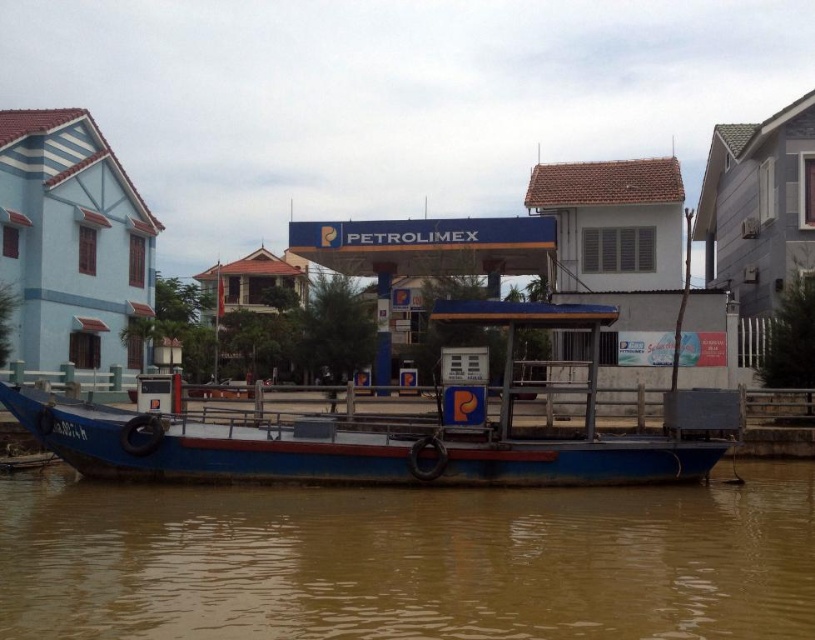
Question: Does brown muddy water at lower center appear on the right side of blue matte boat at center?

Choices:
 (A) no
 (B) yes

Answer: (B)

Question: Is the position of brown muddy water at lower center less distant than that of blue matte boat at center?

Choices:
 (A) no
 (B) yes

Answer: (B)

Question: Does brown muddy water at lower center lie behind blue matte boat at center?

Choices:
 (A) no
 (B) yes

Answer: (A)

Question: Which of the following is the closest to the observer?

Choices:
 (A) brown muddy water at lower center
 (B) blue matte boat at center

Answer: (A)

Question: Among these points, which one is farthest from the camera?

Choices:
 (A) (143, 602)
 (B) (690, 472)

Answer: (B)